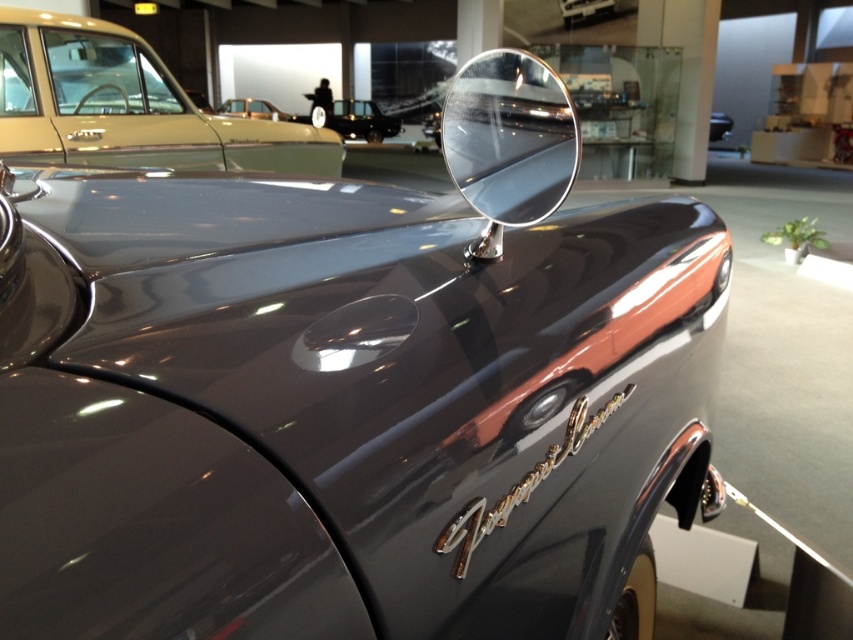
Does silver/metallic view mirror at upper center have a lesser width compared to shiny black car at center?

Yes, silver/metallic view mirror at upper center is thinner than shiny black car at center.

From the picture: Can you confirm if silver/metallic view mirror at upper center is positioned to the right of shiny black car at center?

Yes, silver/metallic view mirror at upper center is to the right of shiny black car at center.

Find the location of a particular element. This screenshot has width=853, height=640. silver/metallic view mirror at upper center is located at coordinates (509, 138).

Identify the location of silver/metallic view mirror at upper center. This screenshot has width=853, height=640. (509, 138).

Can you confirm if shiny black car at center is shorter than gold metallic car at upper center?

Indeed, shiny black car at center has a lesser height compared to gold metallic car at upper center.

Can you confirm if shiny black car at center is positioned above gold metallic car at upper center?

Yes.

Is point (346, 109) positioned after point (248, 106)?

That is True.

Locate an element on the screen. This screenshot has width=853, height=640. shiny black car at center is located at coordinates (360, 120).

Does point (329, 156) lie behind point (561, 90)?

Yes, it is.

Can you confirm if shiny gold car at upper left is positioned to the right of silver/metallic view mirror at upper center?

In fact, shiny gold car at upper left is to the left of silver/metallic view mirror at upper center.

What are the coordinates of `shiny gold car at upper left` in the screenshot? It's located at pos(126,106).